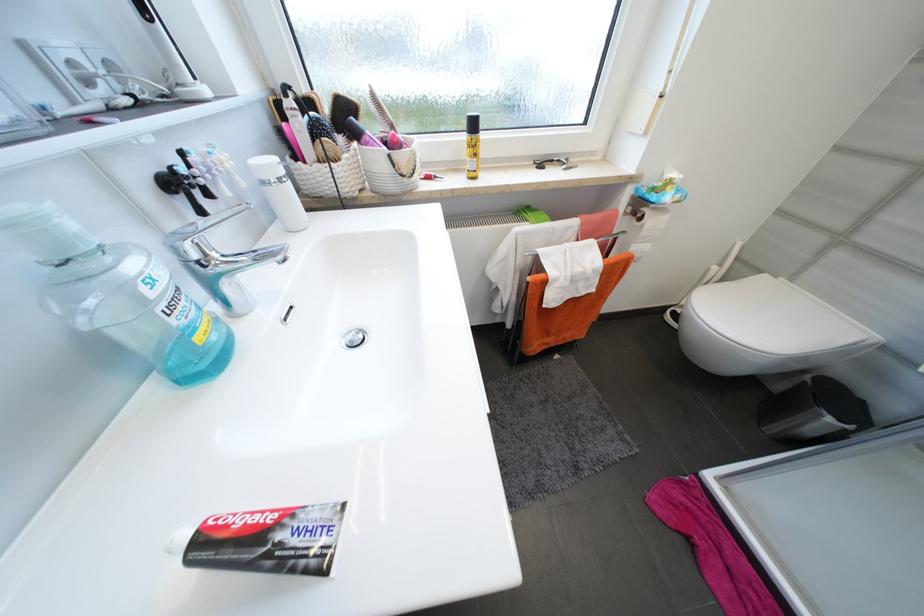
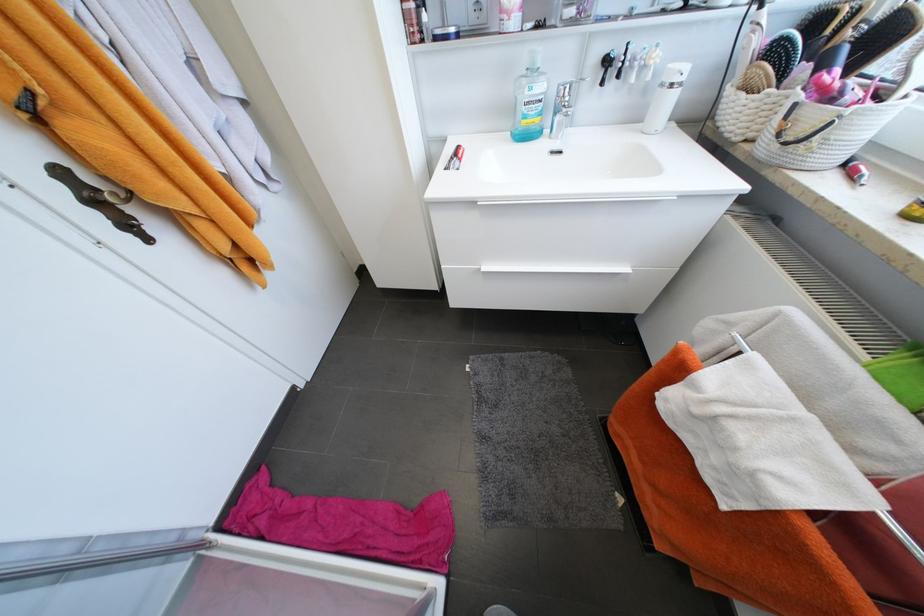
The point at (x=271, y=185) is marked in the first image. Where is the corresponding point in the second image?

(667, 86)